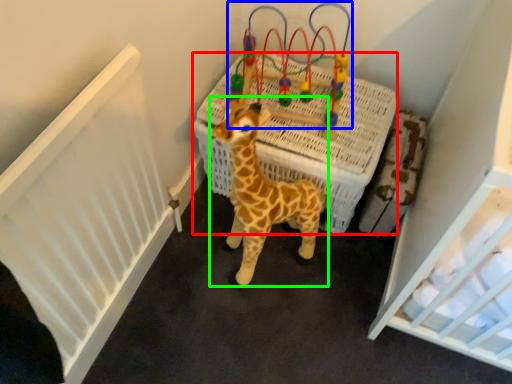
Question: Which object is the closest to the infant bed (highlighted by a red box)? Choose among these: toy (highlighted by a blue box) or giraffe (highlighted by a green box).

Choices:
 (A) toy
 (B) giraffe

Answer: (A)